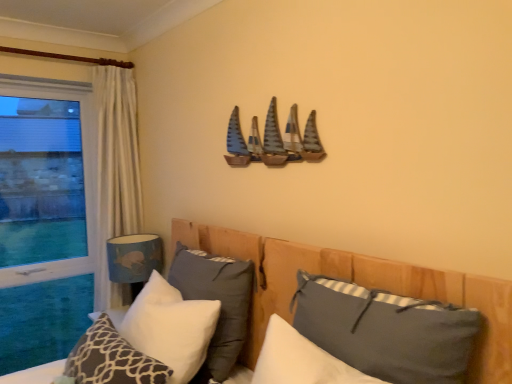
Where is `transparent glass window at left`? The width and height of the screenshot is (512, 384). transparent glass window at left is located at coordinates (45, 218).

The image size is (512, 384). What do you see at coordinates (45, 218) in the screenshot?
I see `transparent glass window at left` at bounding box center [45, 218].

Image resolution: width=512 pixels, height=384 pixels. Describe the element at coordinates (274, 140) in the screenshot. I see `wooden sailboats at upper center` at that location.

How much space does white textured pillow at lower left, arranged as the 1th pillow when viewed from the left, occupy vertically?

white textured pillow at lower left, arranged as the 1th pillow when viewed from the left, is 10.33 inches in height.

Locate an element on the screen. dark gray fabric pillow at lower right, which ranks as the fifth pillow in left-to-right order is located at coordinates (385, 330).

Locate an element on the screen. transparent glass window at left is located at coordinates (45, 218).

Is wooden bed at center inside the boundaries of wooden sailboats at upper center, or outside?

wooden bed at center is not enclosed by wooden sailboats at upper center.

Is wooden bed at center oriented towards wooden sailboats at upper center?

No, wooden bed at center does not turn towards wooden sailboats at upper center.

Is wooden bed at center in contact with wooden sailboats at upper center?

No.

Which of these two, wooden bed at center or wooden sailboats at upper center, is bigger?

Bigger between the two is wooden bed at center.

In order to click on window located behind the wooden bed at center in this screenshot , I will do `click(45, 218)`.

From the image's perspective, which one is positioned higher, wooden bed at center or transparent glass window at left?

transparent glass window at left.

Considering the relative sizes of wooden bed at center and transparent glass window at left in the image provided, is wooden bed at center shorter than transparent glass window at left?

Yes, wooden bed at center is shorter than transparent glass window at left.

In terms of size, does wooden bed at center appear bigger or smaller than transparent glass window at left?

Considering their sizes, wooden bed at center takes up more space than transparent glass window at left.

Is blue fabric lampshade at lower left situated inside white soft pillow at lower left, positioned as the second pillow in left-to-right order, or outside?

blue fabric lampshade at lower left lies outside white soft pillow at lower left, positioned as the second pillow in left-to-right order.

Based on the photo, which of these two, blue fabric lampshade at lower left or white soft pillow at lower left, placed as the fourth pillow when sorted from right to left, is bigger?

Bigger between the two is white soft pillow at lower left, placed as the fourth pillow when sorted from right to left.

From a real-world perspective, between blue fabric lampshade at lower left and white soft pillow at lower left, positioned as the second pillow in left-to-right order, who is vertically higher?

blue fabric lampshade at lower left, from a real-world perspective.

In the image, is dark gray fabric pillow at lower right, the 1th pillow positioned from the right, on the left side or the right side of white soft pillow at lower left, positioned as the second pillow in left-to-right order?

dark gray fabric pillow at lower right, the 1th pillow positioned from the right, is positioned on white soft pillow at lower left, positioned as the second pillow in left-to-right order,'s right side.

Is dark gray fabric pillow at lower right, which ranks as the fifth pillow in left-to-right order, next to white soft pillow at lower left, placed as the fourth pillow when sorted from right to left, and touching it?

They are not placed beside each other.

Considering the points (308, 283) and (170, 289), which point is in front, point (308, 283) or point (170, 289)?

Positioned in front is point (308, 283).

Which is more to the right, white textured pillow at lower left, arranged as the 1th pillow when viewed from the left, or blue fabric lampshade at lower left?

white textured pillow at lower left, arranged as the 1th pillow when viewed from the left, is more to the right.

Considering their positions, is white textured pillow at lower left, the 5th pillow when ordered from right to left, located in front of or behind blue fabric lampshade at lower left?

white textured pillow at lower left, the 5th pillow when ordered from right to left, is positioned closer to the viewer than blue fabric lampshade at lower left.

From the image's perspective, is white textured pillow at lower left, the 5th pillow when ordered from right to left, above or below blue fabric lampshade at lower left?

white textured pillow at lower left, the 5th pillow when ordered from right to left, is below blue fabric lampshade at lower left.

Which point is more forward, (98, 321) or (117, 239)?

Point (98, 321)

There is a white textured pillow at lower left, the 5th pillow when ordered from right to left. Find the location of `boat above it (from a real-world perspective)`. boat above it (from a real-world perspective) is located at coordinates (274, 140).

Between white textured pillow at lower left, the 5th pillow when ordered from right to left, and wooden sailboats at upper center, which one appears on the left side from the viewer's perspective?

white textured pillow at lower left, the 5th pillow when ordered from right to left, is more to the left.

From the image's perspective, is white textured pillow at lower left, the 5th pillow when ordered from right to left, below wooden sailboats at upper center?

Yes, from the image's perspective, white textured pillow at lower left, the 5th pillow when ordered from right to left, is beneath wooden sailboats at upper center.

Which is farther, (193, 323) or (295, 158)?

The point (193, 323) is behind.

From a real-world perspective, is white soft pillow at lower left, placed as the fourth pillow when sorted from right to left, beneath wooden sailboats at upper center?

Yes.

How different are the orientations of white soft pillow at lower left, positioned as the second pillow in left-to-right order, and wooden sailboats at upper center in degrees?

The facing directions of white soft pillow at lower left, positioned as the second pillow in left-to-right order, and wooden sailboats at upper center are 0.757 degrees apart.

How much distance is there between white soft pillow at lower left, placed as the fourth pillow when sorted from right to left, and wooden sailboats at upper center?

white soft pillow at lower left, placed as the fourth pillow when sorted from right to left, is 29.23 inches away from wooden sailboats at upper center.

This screenshot has width=512, height=384. In order to click on bed that is in front of the wooden sailboats at upper center in this screenshot , I will do `click(360, 284)`.

Image resolution: width=512 pixels, height=384 pixels. I want to click on bed below the transparent glass window at left (from the image's perspective), so click(360, 284).

Looking at the image, which one is located closer to blue fabric lampshade at lower left, transparent glass window at left or dark gray fabric pillow at lower right, which ranks as the fifth pillow in left-to-right order?

Based on the image, transparent glass window at left appears to be nearer to blue fabric lampshade at lower left.

Based on their spatial positions, is white soft pillow at center, which is the 3th pillow in left-to-right order, or white soft pillow at lower left, positioned as the second pillow in left-to-right order, closer to blue fabric lampshade at lower left?

white soft pillow at center, which is the 3th pillow in left-to-right order, lies closer to blue fabric lampshade at lower left than the other object.

When comparing their distances from white soft pillow at center, which is the 3th pillow in left-to-right order, does dark gray fabric pillow at center, the second pillow when ordered from right to left, or wooden bed at center seem further?

The object further to white soft pillow at center, which is the 3th pillow in left-to-right order, is dark gray fabric pillow at center, the second pillow when ordered from right to left.

From the image, which object appears to be farther from blue fabric lampshade at lower left, transparent glass window at left or dark gray fabric pillow at center, the second pillow when ordered from right to left?

dark gray fabric pillow at center, the second pillow when ordered from right to left.

From the image, which object appears to be nearer to white textured pillow at lower left, the 5th pillow when ordered from right to left, transparent glass window at left or white soft pillow at center, which is the 3th pillow in left-to-right order?

white soft pillow at center, which is the 3th pillow in left-to-right order.

Considering their positions, is dark gray fabric pillow at center, the second pillow when ordered from right to left, positioned closer to transparent glass window at left than wooden bed at center?

Among the two, wooden bed at center is located nearer to transparent glass window at left.

Estimate the real-world distances between objects in this image. Which object is closer to transparent glass window at left, white soft pillow at lower left, placed as the fourth pillow when sorted from right to left, or white textured pillow at lower left, arranged as the 1th pillow when viewed from the left?

Based on the image, white textured pillow at lower left, arranged as the 1th pillow when viewed from the left, appears to be nearer to transparent glass window at left.

Which object lies further to the anchor point wooden sailboats at upper center, wooden bed at center or transparent glass window at left?

Among the two, transparent glass window at left is located further to wooden sailboats at upper center.

Identify the location of boat located between wooden bed at center and blue fabric lampshade at lower left in the depth direction. (274, 140).

Find the location of a particular element. The height and width of the screenshot is (384, 512). lamp positioned between wooden bed at center and transparent glass window at left from near to far is located at coordinates (133, 261).

Locate an element on the screen. The image size is (512, 384). boat located between dark gray fabric pillow at center, the fourth pillow viewed from the left, and blue fabric lampshade at lower left in the depth direction is located at coordinates (274, 140).

Locate an element on the screen. The image size is (512, 384). pillow between wooden sailboats at upper center and blue fabric lampshade at lower left along the z-axis is located at coordinates pyautogui.click(x=216, y=299).